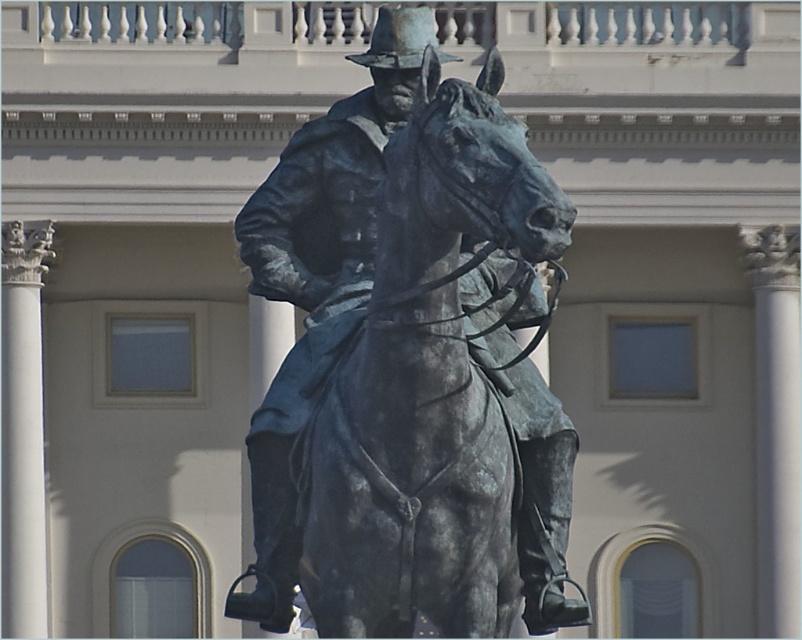
You are an art student analyzing the composition of the image. You notice the bronze statue at center and the shiny bronze cowboy hat at center. Which object is located to the right of the other?

The bronze statue at center is positioned on the left side of shiny bronze cowboy hat at center, so the shiny bronze cowboy hat at center is to the right of the bronze statue at center.

You are standing in front of the bronze statue at center and the shiny bronze cowboy hat at center. Which object is nearer to you?

The bronze statue at center is closer to the viewer than the shiny bronze cowboy hat at center.

You are a tour guide explaining the bronze statue at center and the shiny bronze cowboy hat at center to visitors. Which object is bigger?

The bronze statue at center is larger than the shiny bronze cowboy hat at center.